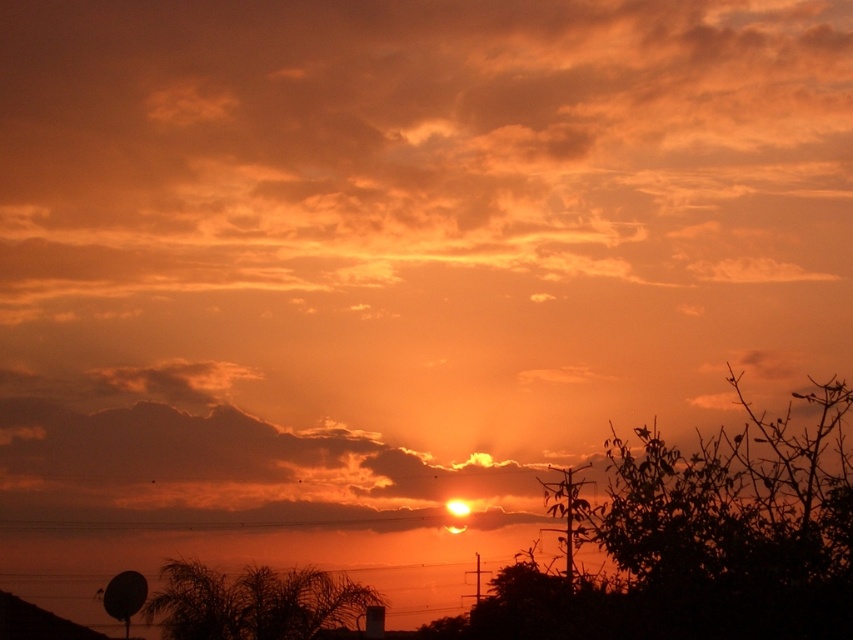
You are an astronomer observing the sunset scene. You notice two silhouette leafy trees in the foreground. Which tree is positioned higher in the image? The options are the silhouette leafy tree at lower right and the silhouette leafy tree at lower left.

The silhouette leafy tree at lower right is positioned higher in the image compared to the silhouette leafy tree at lower left.

In the scene shown: You are an artist sketching this sunset scene. You want to ensure the trees are proportionally accurate. Which silhouette leafy tree has a narrower width between the silhouette leafy tree at lower right and the silhouette leafy tree at lower left?

The silhouette leafy tree at lower right has a lesser width compared to the silhouette leafy tree at lower left, so it is narrower.

You are an astronomer analyzing the sunset scene. You need to determine the exact location of the silhouette leafy tree at lower right in the image. What are its coordinates?

The silhouette leafy tree at lower right is located at coordinates point (730, 529).